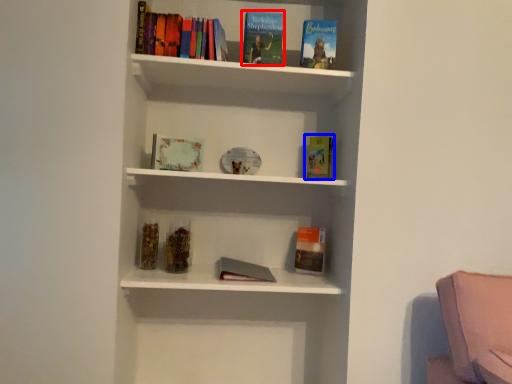
Question: Which point is further to the camera, book (highlighted by a red box) or paperback book (highlighted by a blue box)?

Choices:
 (A) book
 (B) paperback book

Answer: (B)